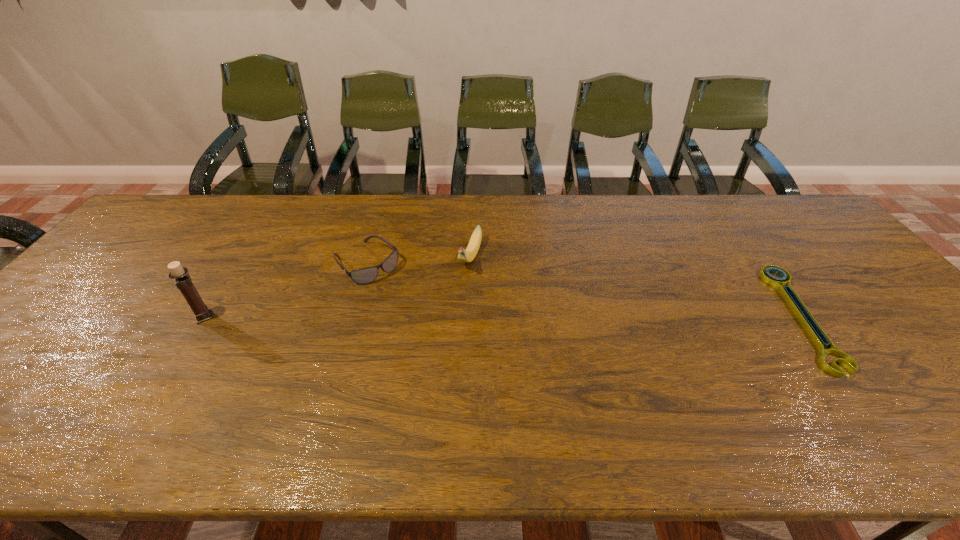
At what (x,y) coordinates should I click in order to perform the action: click on free space on the desktop that is between the tallest object and the shortest object and is positioned at the stem of the second object from right to left. Please return your answer as a coordinate pair (x, y). Looking at the image, I should click on (443, 316).

I want to click on vacant space on the desktop that is between the leftmost object and the wrench and is positioned on the lenses of the third tallest object, so click(426, 316).